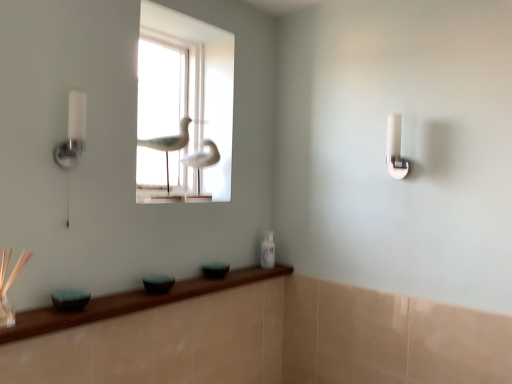
Measure the distance between matte teal glass bowl at lower center, arranged as the second glass bowl when viewed from the front, and camera.

matte teal glass bowl at lower center, arranged as the second glass bowl when viewed from the front, and camera are 1.49 meters apart from each other.

What is the approximate width of white glossy bottle at lower center?

white glossy bottle at lower center is 2.65 inches in width.

You are a GUI agent. You are given a task and a screenshot of the screen. Output one action in this format:
    pyautogui.click(x=<x>, y=<y>)
    Task: Click on the white glossy bottle at lower center
    The width and height of the screenshot is (512, 384).
    Given the screenshot: What is the action you would take?
    pyautogui.click(x=268, y=251)

Measure the distance between point (223, 268) and camera.

Point (223, 268) and camera are 5.76 feet apart from each other.

You are a GUI agent. You are given a task and a screenshot of the screen. Output one action in this format:
    pyautogui.click(x=<x>, y=<y>)
    Task: Click on the white plastic light switch at upper right
    This screenshot has width=512, height=384.
    Given the screenshot: What is the action you would take?
    pyautogui.click(x=395, y=148)

Identify the location of white glossy wall sconce at left. (73, 133).

Where is `matte teal glass bowl at lower center, placed as the second glass bowl when sorted from right to left`? This screenshot has width=512, height=384. matte teal glass bowl at lower center, placed as the second glass bowl when sorted from right to left is located at coordinates (158, 284).

From the image's perspective, is white glossy wall sconce at left beneath green glass bowl at lower center, placed as the third glass bowl when sorted from front to back?

Actually, white glossy wall sconce at left appears above green glass bowl at lower center, placed as the third glass bowl when sorted from front to back, in the image.

Can you confirm if white glossy wall sconce at left is shorter than green glass bowl at lower center, which is the 1th glass bowl from right to left?

No, white glossy wall sconce at left is not shorter than green glass bowl at lower center, which is the 1th glass bowl from right to left.

Would you say green glass bowl at lower center, the third glass bowl when ordered from left to right, is part of white glossy wall sconce at left's contents?

No, green glass bowl at lower center, the third glass bowl when ordered from left to right, is not a part of white glossy wall sconce at left.

Is white glossy wall sconce at left further to the viewer compared to green glass bowl at lower center, which is the 1th glass bowl from back to front?

That is False.

Is white matte bird at center, which is the 1th bird in back-to-front order, directly adjacent to green glass bowl at lower center, placed as the third glass bowl when sorted from front to back?

No, white matte bird at center, which is the 1th bird in back-to-front order, is not making contact with green glass bowl at lower center, placed as the third glass bowl when sorted from front to back.

From the image's perspective, does white matte bird at center, which is the 1th bird in back-to-front order, appear higher than green glass bowl at lower center, the third glass bowl when ordered from left to right?

Yes, from the image's perspective, white matte bird at center, which is the 1th bird in back-to-front order, is over green glass bowl at lower center, the third glass bowl when ordered from left to right.

Considering the positions of points (209, 158) and (213, 272), is point (209, 158) farther from camera compared to point (213, 272)?

Yes, it is behind point (213, 272).

Which object is positioned more to the left, white matte bird at center, which appears as the 2th bird when viewed from the front, or green glass bowl at lower center, which is the 1th glass bowl from right to left?

Positioned to the left is white matte bird at center, which appears as the 2th bird when viewed from the front.

Does transparent glass door at center have a greater height compared to white glossy bottle at lower center?

Correct, transparent glass door at center is much taller as white glossy bottle at lower center.

Looking at their sizes, would you say transparent glass door at center is wider or thinner than white glossy bottle at lower center?

Considering their sizes, transparent glass door at center looks broader than white glossy bottle at lower center.

From a real-world perspective, is transparent glass door at center on top of white glossy bottle at lower center?

Yes, from a real-world perspective, transparent glass door at center is over white glossy bottle at lower center

Is transparent glass door at center with white glossy bottle at lower center?

No, transparent glass door at center is not in contact with white glossy bottle at lower center.

Is white plastic light switch at upper right outside of teal glass bowl at lower left, placed as the third glass bowl when sorted from back to front?

Yes, white plastic light switch at upper right is outside of teal glass bowl at lower left, placed as the third glass bowl when sorted from back to front.

Is white plastic light switch at upper right touching teal glass bowl at lower left, placed as the third glass bowl when sorted from back to front?

No.

Considering the positions of points (393, 152) and (57, 299), is point (393, 152) closer to camera compared to point (57, 299)?

No, it is not.

Is white plastic light switch at upper right oriented towards teal glass bowl at lower left, placed as the third glass bowl when sorted from back to front?

No, white plastic light switch at upper right is not facing towards teal glass bowl at lower left, placed as the third glass bowl when sorted from back to front.

From the image's perspective, which is below, teal glass bowl at lower left, the first glass bowl when ordered from front to back, or green glass bowl at lower center, the third glass bowl when ordered from left to right?

From the image's view, teal glass bowl at lower left, the first glass bowl when ordered from front to back, is below.

Can we say teal glass bowl at lower left, placed as the third glass bowl when sorted from back to front, lies outside green glass bowl at lower center, the third glass bowl when ordered from left to right?

That's correct, teal glass bowl at lower left, placed as the third glass bowl when sorted from back to front, is outside of green glass bowl at lower center, the third glass bowl when ordered from left to right.

The image size is (512, 384). I want to click on the 2nd glass bowl below the green glass bowl at lower center, which is the 1th glass bowl from back to front (from a real-world perspective), so click(70, 300).

Is teal glass bowl at lower left, the first glass bowl when ordered from front to back, looking in the opposite direction of green glass bowl at lower center, placed as the third glass bowl when sorted from front to back?

No, teal glass bowl at lower left, the first glass bowl when ordered from front to back,'s orientation is not away from green glass bowl at lower center, placed as the third glass bowl when sorted from front to back.

Looking at this image, is white plastic light switch at upper right positioned with its back to matte teal glass bowl at lower center, placed as the second glass bowl when sorted from right to left?

No, white plastic light switch at upper right is not facing away from matte teal glass bowl at lower center, placed as the second glass bowl when sorted from right to left.

Which is less distant, (397, 150) or (165, 292)?

The point (165, 292) is closer to the camera.

From a real-world perspective, relative to matte teal glass bowl at lower center, arranged as the second glass bowl when viewed from the front, is white plastic light switch at upper right vertically above or below?

white plastic light switch at upper right is above matte teal glass bowl at lower center, arranged as the second glass bowl when viewed from the front.

Based on their sizes in the image, would you say white plastic light switch at upper right is bigger or smaller than matte teal glass bowl at lower center, arranged as the second glass bowl when viewed from the front?

In the image, white plastic light switch at upper right appears to be larger than matte teal glass bowl at lower center, arranged as the second glass bowl when viewed from the front.

Is white glossy bottle at lower center thinner than white glossy wall sconce at left?

Yes.

Would you say white glossy bottle at lower center is a long distance from white glossy wall sconce at left?

Yes, white glossy bottle at lower center is far from white glossy wall sconce at left.

Measure the distance between white glossy bottle at lower center and white glossy wall sconce at left.

They are 1.01 meters apart.

Find the location of `lamp that is above the white glossy bottle at lower center (from a real-world perspective)`. lamp that is above the white glossy bottle at lower center (from a real-world perspective) is located at coordinates (73, 133).

Locate an element on the screen. The height and width of the screenshot is (384, 512). the 1st glass bowl below the white glossy wall sconce at left (from the image's perspective) is located at coordinates (215, 270).

Image resolution: width=512 pixels, height=384 pixels. What are the coordinates of `bird located behind the green glass bowl at lower center, the third glass bowl when ordered from left to right` in the screenshot? It's located at (202, 159).

From the image, which object appears to be farther from white matte bird at center, which is the 1th bird in back-to-front order, matte teal glass bowl at lower center, arranged as the second glass bowl when viewed from the front, or teal glass bowl at lower left, placed as the third glass bowl when sorted from back to front?

teal glass bowl at lower left, placed as the third glass bowl when sorted from back to front, is positioned further to the anchor white matte bird at center, which is the 1th bird in back-to-front order.

Which object lies nearer to the anchor point transparent glass door at center, white plastic light switch at upper right or teal glass bowl at lower left, the first glass bowl when ordered from front to back?

teal glass bowl at lower left, the first glass bowl when ordered from front to back, is closer to transparent glass door at center.

Estimate the real-world distances between objects in this image. Which object is closer to green glass bowl at lower center, which is the 1th glass bowl from back to front, white glossy wall sconce at left or teal glass bowl at lower left, acting as the 3th glass bowl starting from the right?

Among the two, teal glass bowl at lower left, acting as the 3th glass bowl starting from the right, is located nearer to green glass bowl at lower center, which is the 1th glass bowl from back to front.

Looking at the image, which one is located closer to matte teal glass bowl at lower center, placed as the second glass bowl when sorted from right to left, green glass bowl at lower center, which is the 1th glass bowl from back to front, or white glossy bird at center, which is the second bird in back-to-front order?

green glass bowl at lower center, which is the 1th glass bowl from back to front, is positioned closer to the anchor matte teal glass bowl at lower center, placed as the second glass bowl when sorted from right to left.

When comparing their distances from transparent glass door at center, does white matte bird at center, which is the 1th bird in back-to-front order, or green glass bowl at lower center, placed as the third glass bowl when sorted from front to back, seem further?

green glass bowl at lower center, placed as the third glass bowl when sorted from front to back, is positioned further to the anchor transparent glass door at center.

Which object lies further to the anchor point white glossy bottle at lower center, teal glass bowl at lower left, acting as the first glass bowl starting from the left, or white matte bird at center, which appears as the 2th bird when viewed from the front?

teal glass bowl at lower left, acting as the first glass bowl starting from the left.

From the image, which object appears to be farther from white plastic light switch at upper right, white glossy bottle at lower center or transparent glass door at center?

Based on the image, transparent glass door at center appears to be further to white plastic light switch at upper right.

From the image, which object appears to be nearer to white glossy wall sconce at left, matte teal glass bowl at lower center, arranged as the second glass bowl when viewed from the front, or teal glass bowl at lower left, the first glass bowl when ordered from front to back?

teal glass bowl at lower left, the first glass bowl when ordered from front to back, lies closer to white glossy wall sconce at left than the other object.

Where is `bird between white glossy bird at center, which is the second bird in back-to-front order, and matte teal glass bowl at lower center, placed as the second glass bowl when sorted from left to right, from top to bottom`? This screenshot has height=384, width=512. bird between white glossy bird at center, which is the second bird in back-to-front order, and matte teal glass bowl at lower center, placed as the second glass bowl when sorted from left to right, from top to bottom is located at coordinates (202, 159).

What are the coordinates of `lamp positioned between teal glass bowl at lower left, acting as the 3th glass bowl starting from the right, and white matte bird at center, which appears as the 2th bird when viewed from the front, from near to far` in the screenshot? It's located at (73, 133).

You are a GUI agent. You are given a task and a screenshot of the screen. Output one action in this format:
    pyautogui.click(x=<x>, y=<y>)
    Task: Click on the toiletry between white glossy bird at center, which is the second bird in back-to-front order, and green glass bowl at lower center, which is the 1th glass bowl from back to front, in the up-down direction
    The image size is (512, 384).
    Given the screenshot: What is the action you would take?
    pyautogui.click(x=268, y=251)

At what (x,y) coordinates should I click in order to perform the action: click on lamp between transparent glass door at center and teal glass bowl at lower left, placed as the third glass bowl when sorted from back to front, in the vertical direction. Please return your answer as a coordinate pair (x, y). Looking at the image, I should click on (73, 133).